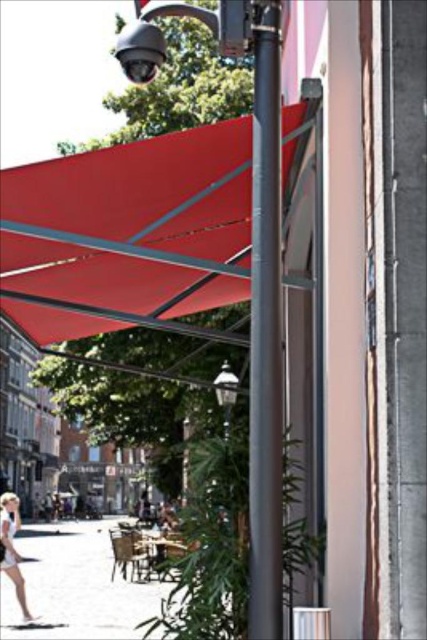
You are a photographer trying to capture the entire matte red awning at center and the white cotton dress at lower left in a single frame. Based on their sizes, which object will occupy more horizontal space in the photo?

The matte red awning at center will occupy more horizontal space in the photo since its width surpasses that of the white cotton dress at lower left.

You are a delivery person with a cart that is 2 meters wide. You need to move from the smooth concrete pavement at lower left to the smooth gray pole at center. Can your cart fit through the space between them?

The smooth gray pole at center is 13.55 meters from the smooth concrete pavement at lower left, so yes, the cart can fit through the space between them since the distance is much larger than the cart width.